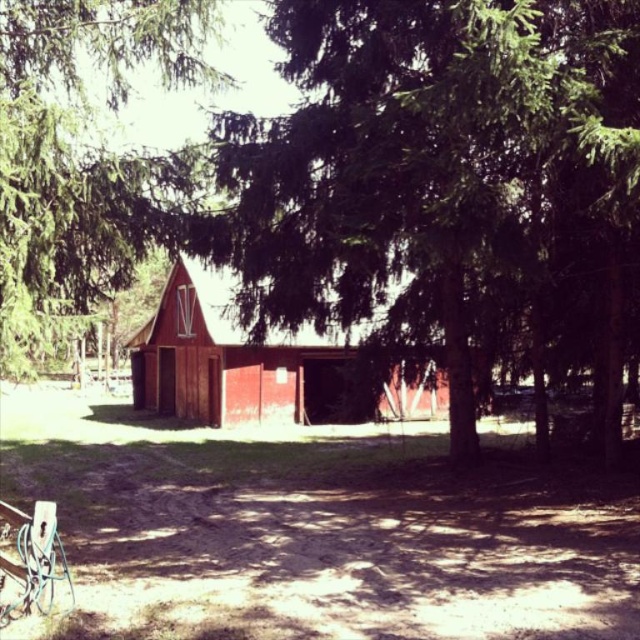
Question: Is green leafy tree at left above matte red barn at center?

Choices:
 (A) no
 (B) yes

Answer: (B)

Question: Does green leafy tree at left have a greater width compared to matte red barn at center?

Choices:
 (A) no
 (B) yes

Answer: (A)

Question: Among these points, which one is farthest from the camera?

Choices:
 (A) (256, 371)
 (B) (173, 51)

Answer: (A)

Question: Can you confirm if green leafy tree at left is wider than matte red barn at center?

Choices:
 (A) no
 (B) yes

Answer: (A)

Question: Which point is farther to the camera?

Choices:
 (A) (228, 284)
 (B) (1, 132)

Answer: (A)